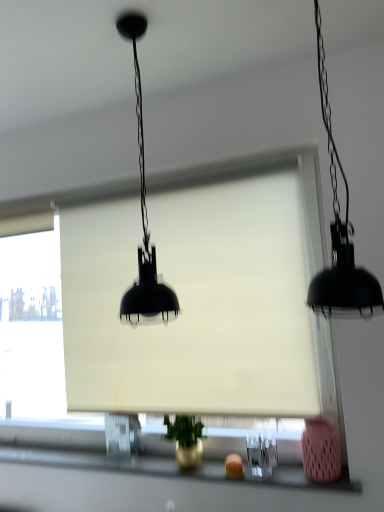
Where is `free spot above white matte window screen at center (from a real-world perspective)`? The width and height of the screenshot is (384, 512). free spot above white matte window screen at center (from a real-world perspective) is located at coordinates (195, 173).